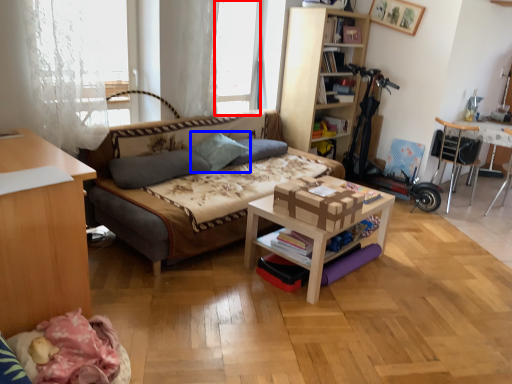
Question: Which object is closer to the camera taking this photo, window screen (highlighted by a red box) or pillow (highlighted by a blue box)?

Choices:
 (A) window screen
 (B) pillow

Answer: (B)